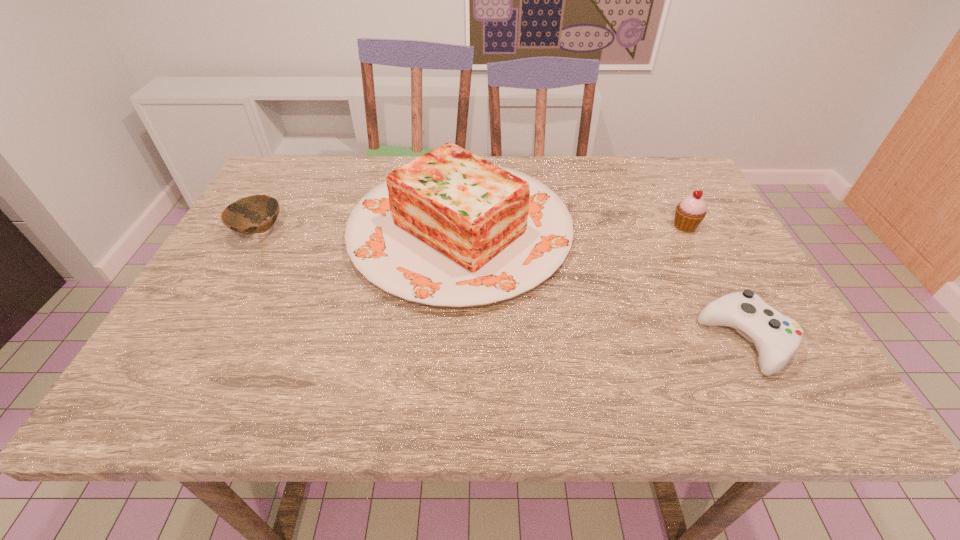
Locate an element on the screen. This screenshot has height=540, width=960. object that is at the near edge is located at coordinates (777, 338).

Identify the location of object that is positioned at the left edge. (243, 216).

You are a GUI agent. You are given a task and a screenshot of the screen. Output one action in this format:
    pyautogui.click(x=<x>, y=<y>)
    Task: Click on the cupcake that is at the right edge
    
    Given the screenshot: What is the action you would take?
    click(689, 213)

Find the location of `control situated at the right edge`. control situated at the right edge is located at coordinates (777, 338).

You are a GUI agent. You are given a task and a screenshot of the screen. Output one action in this format:
    pyautogui.click(x=<x>, y=<y>)
    Task: Click on the object that is at the near right corner
    This screenshot has height=540, width=960.
    Given the screenshot: What is the action you would take?
    pyautogui.click(x=777, y=338)

The image size is (960, 540). Find the location of `vacant space at the far edge of the desktop`. vacant space at the far edge of the desktop is located at coordinates (636, 195).

The height and width of the screenshot is (540, 960). In order to click on vacant area at the near edge of the desktop in this screenshot , I will do `click(254, 371)`.

The image size is (960, 540). Identify the location of vacant area at the left edge of the desktop. (286, 210).

This screenshot has width=960, height=540. In the image, there is a desktop. Find the location of `vacant space at the right edge`. vacant space at the right edge is located at coordinates (684, 235).

The height and width of the screenshot is (540, 960). In the image, there is a desktop. In order to click on free space at the far left corner in this screenshot , I will do `click(295, 180)`.